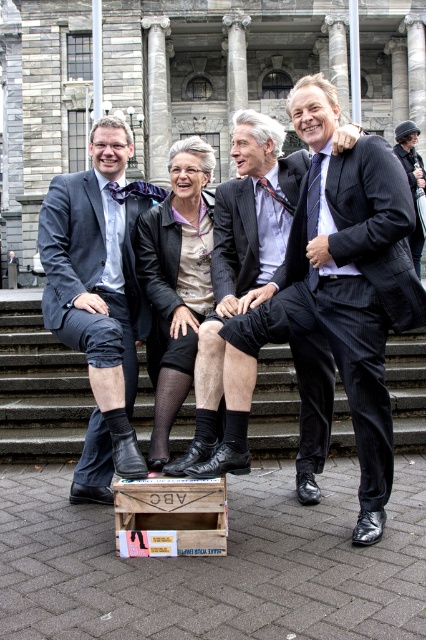
Question: Based on their relative distances, which object is nearer to the dark blue suit at center?

Choices:
 (A) wooden crate at lower center
 (B) matte black suit at center

Answer: (A)

Question: Can you confirm if matte black suit at center is positioned to the left of silk tie at right?

Choices:
 (A) yes
 (B) no

Answer: (A)

Question: Which object appears farthest from the camera in this image?

Choices:
 (A) matte black suit at center
 (B) dark gray suit at center
 (C) wooden crate at lower center
 (D) silk tie at right

Answer: (D)

Question: Among these objects, which one is nearest to the camera?

Choices:
 (A) wooden crate at lower center
 (B) matte black suit at center

Answer: (A)

Question: Is dark blue suit at center bigger than matte black suit at center?

Choices:
 (A) no
 (B) yes

Answer: (A)

Question: Is black leather shoes at lower center bigger than wooden crate at lower center?

Choices:
 (A) no
 (B) yes

Answer: (B)